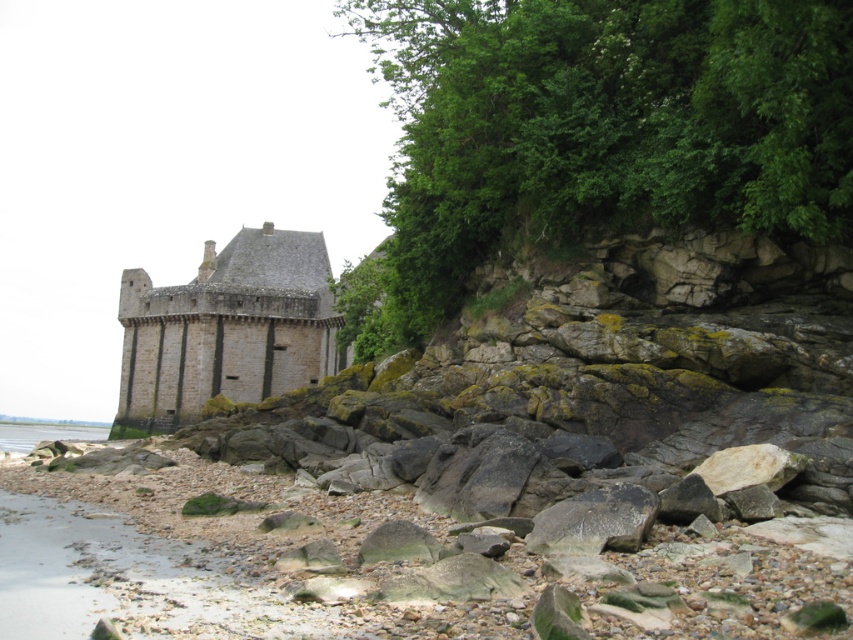
You are standing on the rugged, rocky beach in the scene and want to take a photo of the green leafy tree at upper right and smooth pebbles at lower left. Which object should you focus on first if you want to capture both in a single frame without moving your camera?

You should focus on the smooth pebbles at lower left first because the green leafy tree at upper right is taller and will naturally appear in the background, allowing both objects to be captured in the frame.

You are a tourist standing on the rocky beach and want to take a photo of the stone gray castle at center and the clear water at lower left. Which object should you point your camera towards first if you want to capture both in a single frame without moving your camera?

You should point your camera towards the clear water at lower left first because the stone gray castle at center is to the right of it, so capturing the clear water at lower left first will allow the stone gray castle at center to be included in the frame to the right side.

You are standing at the camera position looking at the coastal scene. There is a point marked at coordinates point (x=425, y=566). Can you determine if this point is within the historic stone structure or on the rocky beach?

The point (x=425, y=566) is 38.01 meters away from the camera, so it is located on the rocky beach rather than within the historic stone structure.